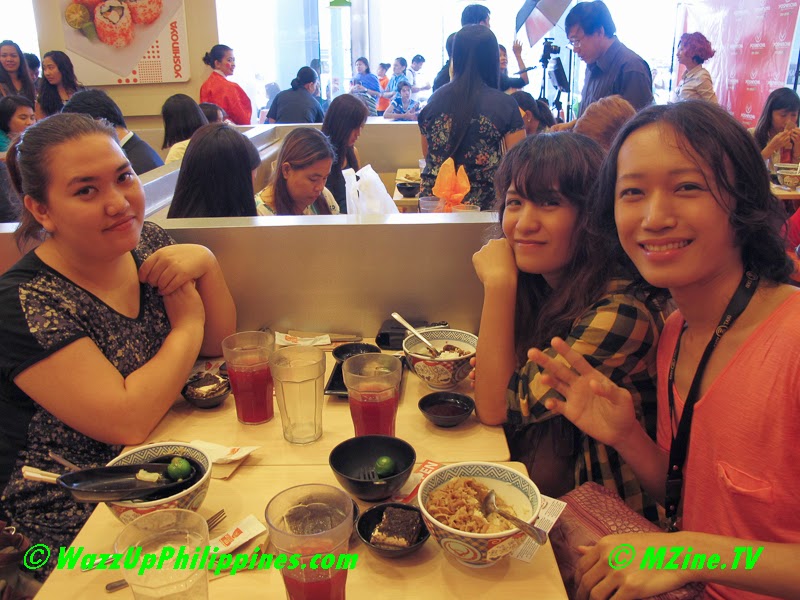
Image resolution: width=800 pixels, height=600 pixels. What are the coordinates of `chopsticks` in the screenshot? It's located at (34, 472).